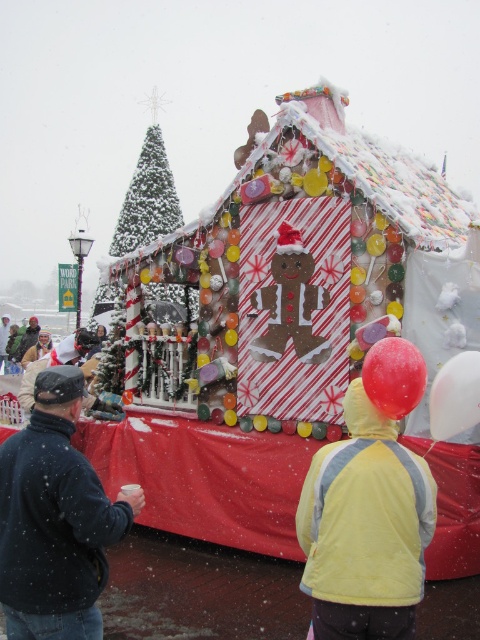
You are standing at the center of the gingerbread house float and want to reach the black fleece jacket at lower left. Which direction should you move to get there?

The black fleece jacket at lower left is located at point (55, 518), so you should move towards the lower left direction to reach it.